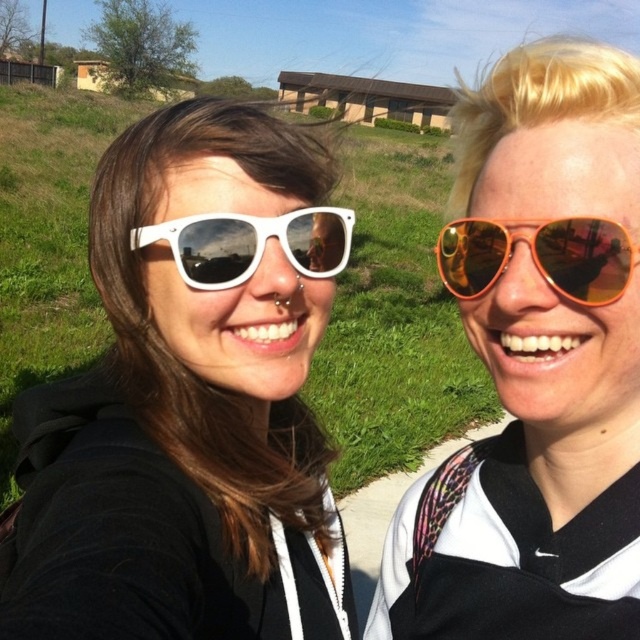
Question: Does white matte sunglasses at upper left appear on the right side of white matte sunglasses at center?

Choices:
 (A) no
 (B) yes

Answer: (A)

Question: Is orange reflective sunglasses at upper right positioned behind white matte sunglasses at center?

Choices:
 (A) yes
 (B) no

Answer: (B)

Question: Is white matte sunglasses at upper left in front of orange reflective sunglasses at right?

Choices:
 (A) yes
 (B) no

Answer: (A)

Question: Which object is closer to the camera taking this photo?

Choices:
 (A) white matte sunglasses at upper left
 (B) orange reflective sunglasses at right
 (C) white matte sunglasses at center

Answer: (A)

Question: Which point is farther to the camera?

Choices:
 (A) white matte sunglasses at center
 (B) orange reflective sunglasses at right

Answer: (A)

Question: Which of these objects is positioned farthest from the orange reflective sunglasses at upper right?

Choices:
 (A) white matte sunglasses at center
 (B) orange reflective sunglasses at right

Answer: (A)